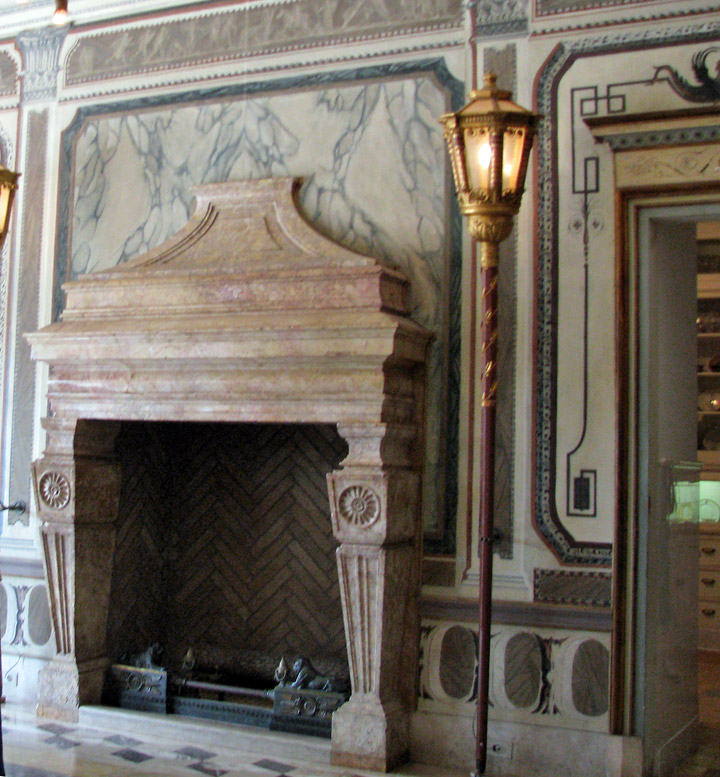
Where is `fireplace`? fireplace is located at coordinates (228, 688).